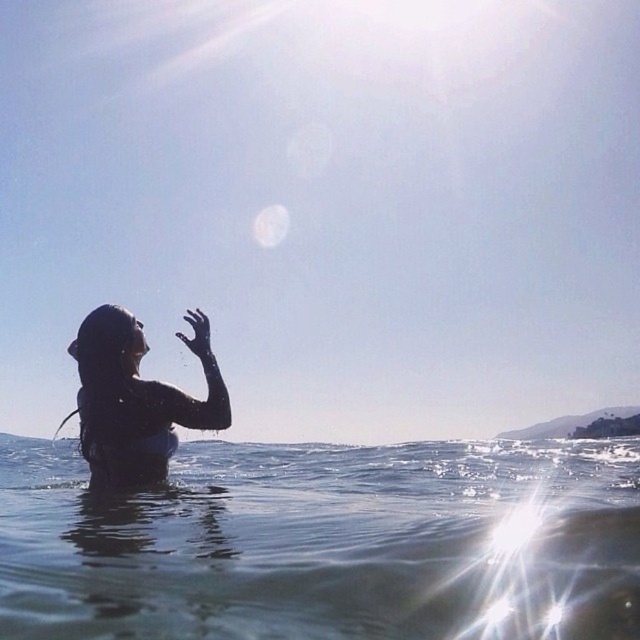
Question: Where is clear liquid water at center located in relation to wet hair at left in the image?

Choices:
 (A) left
 (B) right

Answer: (B)

Question: Which point is farther to the camera?

Choices:
 (A) clear liquid water at center
 (B) wet hair at left

Answer: (B)

Question: Can you confirm if clear liquid water at center is smaller than wet hair at left?

Choices:
 (A) no
 (B) yes

Answer: (B)

Question: Which of the following is the farthest from the observer?

Choices:
 (A) wet hair at left
 (B) clear liquid water at center

Answer: (A)

Question: Observing the image, what is the correct spatial positioning of clear liquid water at center in reference to wet hair at left?

Choices:
 (A) above
 (B) below

Answer: (B)

Question: Which object is closer to the camera taking this photo?

Choices:
 (A) clear liquid water at center
 (B) wet hair at left

Answer: (A)